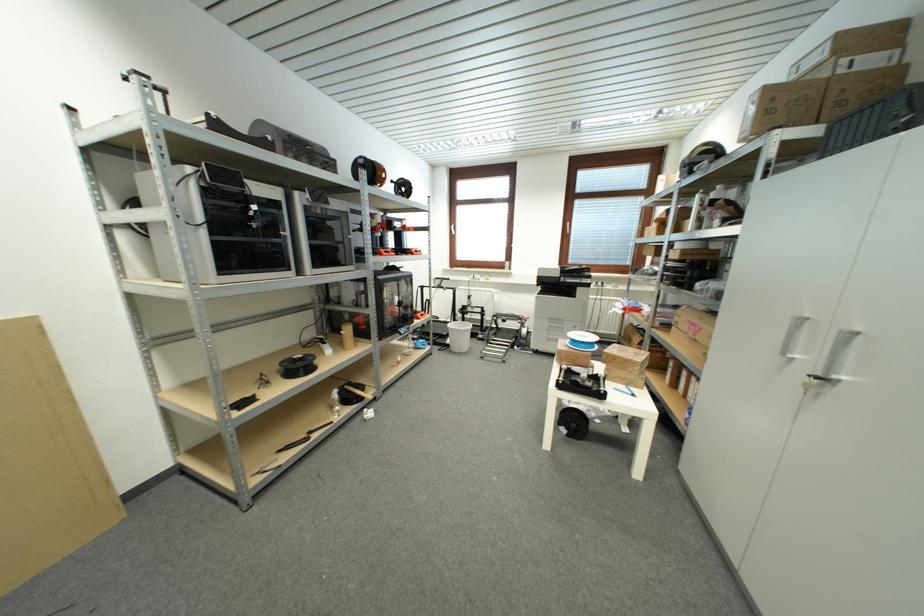
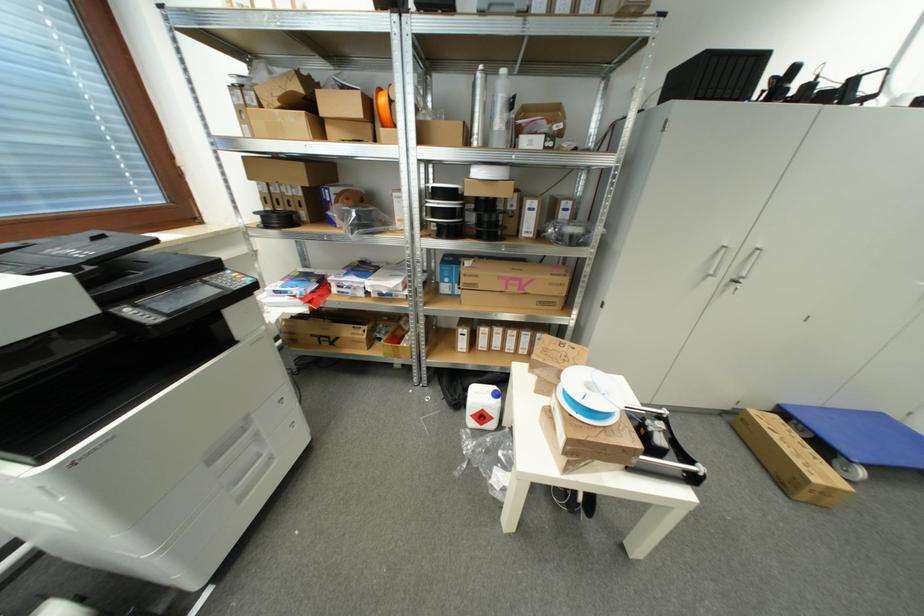
Locate, in the second image, the point that corresponds to point (566, 331) in the first image.

(261, 438)